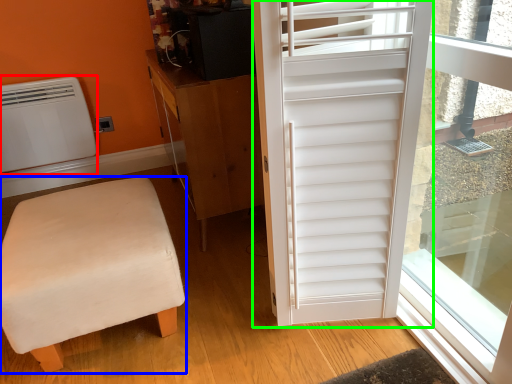
Question: Considering the real-world distances, which object is farthest from air conditioning (highlighted by a red box)? furniture (highlighted by a blue box) or door (highlighted by a green box)?

Choices:
 (A) furniture
 (B) door

Answer: (B)